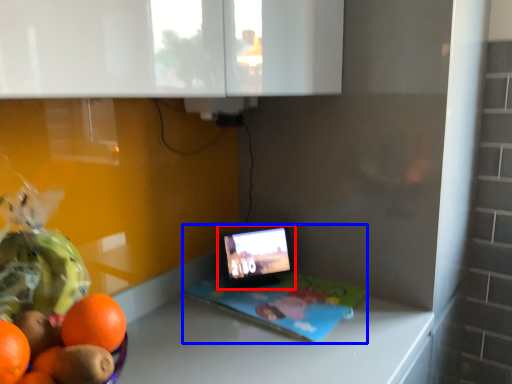
Question: Which of the following is the farthest to the observer, tablet computer (highlighted by a red box) or laptop (highlighted by a blue box)?

Choices:
 (A) tablet computer
 (B) laptop

Answer: (A)